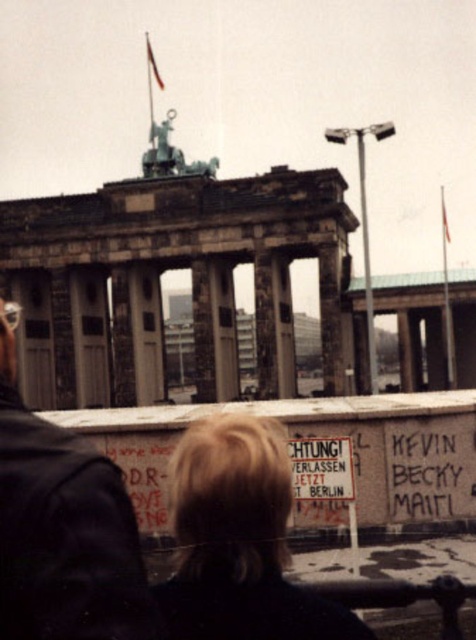
You are a tourist visiting the Brandenburg Gate and you see a person wearing a dark gray jacket at center and someone with blonde hair at lower center. Which object is nearer to you?

The dark gray jacket at center is closer to the viewer than the blonde hair at lower center.

You are a photographer at the Brandenburg Gate. You have a camera with a 50mm lens and want to capture both the dark gray jacket at center and the blonde hair at lower center in the same frame. Given the size difference between them, which object would appear larger in your photo?

The dark gray jacket at center would appear larger in the photo because it is bigger than the blonde hair at lower center.

You are a photographer trying to capture a shot of the Brandenburg Gate. You notice a person wearing a dark gray jacket at center and another with blonde hair at lower center. From your position, which object is closer to the left side of the frame?

The dark gray jacket at center is to the left of blonde hair at lower center, so the dark gray jacket at center is closer to the left side of the frame.